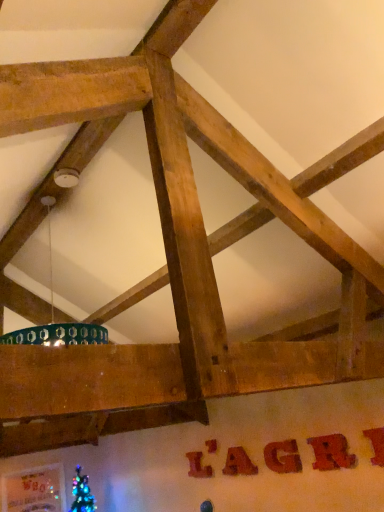
Question: Which direction should I rotate to look at brushed wood letter at center, the sixth letter when ordered from right to left?

Choices:
 (A) left
 (B) right

Answer: (B)

Question: From the image's perspective, would you say wooden sign at center, which appears as the first letter when viewed from the front, is shown under metallic gold letter at center, marked as the second letter in a left-to-right arrangement?

Choices:
 (A) yes
 (B) no

Answer: (B)

Question: Is wooden sign at center, which is counted as the 1th letter, starting from the right, looking in the opposite direction of metallic gold letter at center, marked as the second letter in a left-to-right arrangement?

Choices:
 (A) yes
 (B) no

Answer: (B)

Question: From a real-world perspective, is wooden sign at center, which is counted as the 1th letter, starting from the right, positioned over metallic gold letter at center, marked as the second letter in a left-to-right arrangement, based on gravity?

Choices:
 (A) no
 (B) yes

Answer: (A)

Question: Considering the relative sizes of wooden sign at center, which is counted as the 1th letter, starting from the right, and metallic gold letter at center, the sixth letter positioned from the front, in the image provided, is wooden sign at center, which is counted as the 1th letter, starting from the right, bigger than metallic gold letter at center, the sixth letter positioned from the front,?

Choices:
 (A) no
 (B) yes

Answer: (B)

Question: Considering the relative positions of wooden sign at center, the 6th letter viewed from the left, and metallic gold letter at center, the 1th letter when ordered from back to front, in the image provided, is wooden sign at center, the 6th letter viewed from the left, to the right of metallic gold letter at center, the 1th letter when ordered from back to front, from the viewer's perspective?

Choices:
 (A) yes
 (B) no

Answer: (A)

Question: Could you tell me if wooden sign at center, positioned as the sixth letter in back-to-front order, is facing metallic gold letter at center, marked as the second letter in a left-to-right arrangement?

Choices:
 (A) no
 (B) yes

Answer: (A)

Question: Does brushed wood letter at center, the 1th letter in the left-to-right sequence, have a smaller size compared to matte brown letter at center, which appears as the 4th letter when viewed from the back?

Choices:
 (A) no
 (B) yes

Answer: (B)

Question: Does brushed wood letter at center, the sixth letter when ordered from right to left, touch matte brown letter at center, which appears as the 4th letter when viewed from the back?

Choices:
 (A) no
 (B) yes

Answer: (A)

Question: Is brushed wood letter at center, the fifth letter from the front, completely or partially outside of matte brown letter at center, the 3th letter viewed from the front?

Choices:
 (A) no
 (B) yes

Answer: (B)

Question: Is brushed wood letter at center, the sixth letter when ordered from right to left, positioned with its back to matte brown letter at center, the third letter from the right?

Choices:
 (A) no
 (B) yes

Answer: (A)

Question: From a real-world perspective, is brushed wood letter at center, positioned as the second letter in back-to-front order, below matte brown letter at center, the third letter from the right?

Choices:
 (A) no
 (B) yes

Answer: (A)

Question: Are brushed wood letter at center, positioned as the second letter in back-to-front order, and matte brown letter at center, the 4th letter positioned from the left, far apart?

Choices:
 (A) yes
 (B) no

Answer: (B)

Question: Is matte brown letter at center, which appears as the 4th letter when viewed from the back, next to brushed wood letter at center, the 1th letter in the left-to-right sequence, and touching it?

Choices:
 (A) yes
 (B) no

Answer: (B)